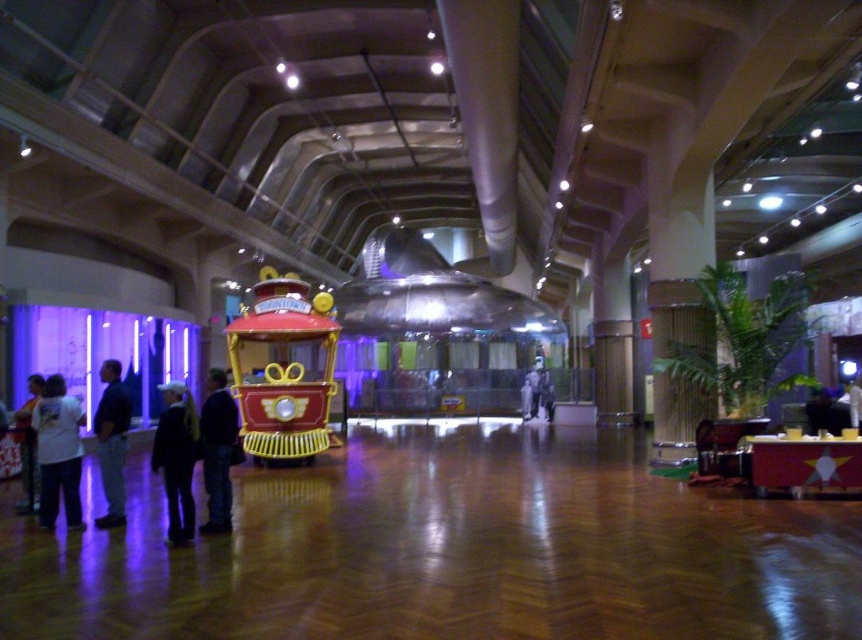
Can you confirm if shiny red train car at center is positioned to the right of dark blue fabric jacket at lower left?

No, shiny red train car at center is not to the right of dark blue fabric jacket at lower left.

Who is shorter, shiny red train car at center or dark blue fabric jacket at lower left?

dark blue fabric jacket at lower left is shorter.

Identify the location of shiny red train car at center. The image size is (862, 640). (284, 369).

Does white cotton shirt at lower left have a smaller size compared to blue denim jeans at center?

Actually, white cotton shirt at lower left might be larger than blue denim jeans at center.

What do you see at coordinates (58, 452) in the screenshot?
I see `white cotton shirt at lower left` at bounding box center [58, 452].

Locate an element on the screen. white cotton shirt at lower left is located at coordinates (58, 452).

At what (x,y) coordinates should I click in order to perform the action: click on white cotton shirt at lower left. Please return your answer as a coordinate pair (x, y). The height and width of the screenshot is (640, 862). Looking at the image, I should click on (58, 452).

Does metallic silver train at center have a greater width compared to dark blue fabric jacket at lower left?

Yes, metallic silver train at center is wider than dark blue fabric jacket at lower left.

Who is shorter, metallic silver train at center or dark blue fabric jacket at lower left?

dark blue fabric jacket at lower left is shorter.

Find the location of `metallic silver train at center`. metallic silver train at center is located at coordinates (431, 326).

This screenshot has height=640, width=862. I want to click on metallic silver train at center, so click(x=431, y=326).